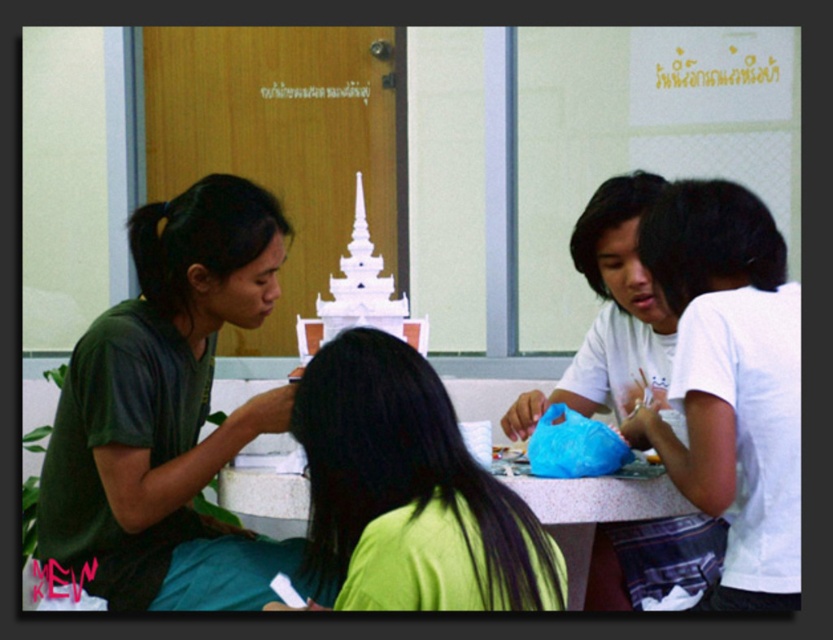
Question: Does green matte shirt at center lie behind smooth plastic table at center?

Choices:
 (A) no
 (B) yes

Answer: (A)

Question: Which is farther from the white cotton shirt at right?

Choices:
 (A) green matte shirt at center
 (B) smooth plastic table at center
 (C) dark green t-shirt at left

Answer: (C)

Question: Which object is closer to the camera taking this photo?

Choices:
 (A) smooth plastic table at center
 (B) dark green t-shirt at left
 (C) white cotton shirt at right

Answer: (C)

Question: Does dark green t-shirt at left appear under smooth plastic table at center?

Choices:
 (A) yes
 (B) no

Answer: (B)

Question: Which of the following is the closest to the observer?

Choices:
 (A) dark green t-shirt at left
 (B) green matte shirt at center
 (C) smooth plastic table at center
 (D) white cotton shirt at right

Answer: (B)

Question: Can you confirm if white cotton shirt at right is positioned to the left of green matte shirt at center?

Choices:
 (A) no
 (B) yes

Answer: (A)